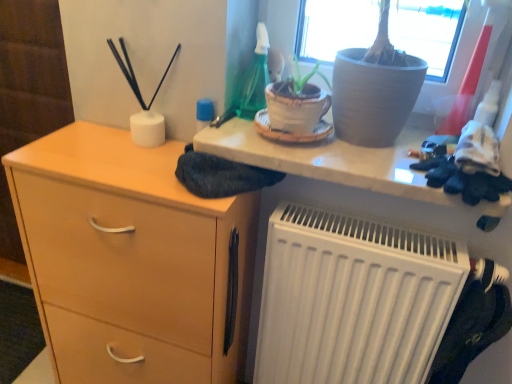
Where is `free space above light wood/finish chest of drawers at left (from a real-world perspective)`? free space above light wood/finish chest of drawers at left (from a real-world perspective) is located at coordinates (113, 154).